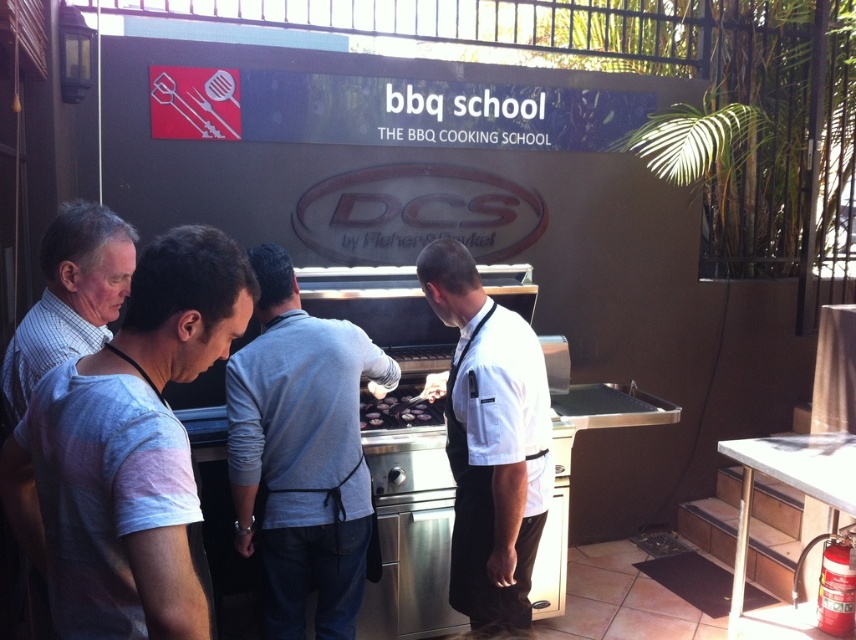
Question: Can you confirm if white matte shirt at center is smaller than white checkered shirt at left?

Choices:
 (A) yes
 (B) no

Answer: (B)

Question: Does white cotton t-shirt at center have a smaller size compared to gray cotton shirt at center?

Choices:
 (A) no
 (B) yes

Answer: (B)

Question: Which point is closer to the camera?

Choices:
 (A) white cotton t-shirt at center
 (B) gray cotton shirt at center
 (C) white checkered shirt at left

Answer: (A)

Question: Based on their relative distances, which object is nearer to the white matte shirt at center?

Choices:
 (A) white cotton t-shirt at center
 (B) gray cotton shirt at center
 (C) black matte grill at center

Answer: (B)

Question: Does gray cotton shirt at center come behind white matte shirt at center?

Choices:
 (A) yes
 (B) no

Answer: (A)

Question: Which is farther from the white checkered shirt at left?

Choices:
 (A) white matte shirt at center
 (B) gray cotton shirt at center

Answer: (A)